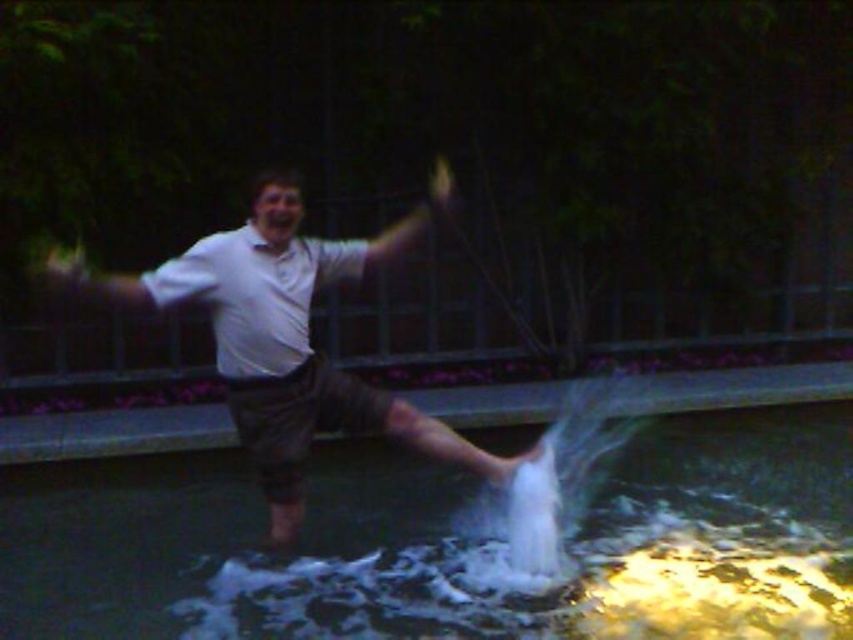
Question: Which point appears farthest from the camera in this image?

Choices:
 (A) (299, 548)
 (B) (260, 193)
 (C) (595, 433)

Answer: (C)

Question: Is white frothy water at center to the left of white cotton shirt at center from the viewer's perspective?

Choices:
 (A) no
 (B) yes

Answer: (A)

Question: Which object is closer to the camera taking this photo?

Choices:
 (A) white cotton shirt at center
 (B) white frothy water at center

Answer: (B)

Question: Which of the following is the farthest from the observer?

Choices:
 (A) (770, 429)
 (B) (570, 516)
 (C) (318, 381)

Answer: (A)

Question: Does white frothy water at center come in front of white frothy water at lower center?

Choices:
 (A) no
 (B) yes

Answer: (B)

Question: Is white frothy water at center to the left of white cotton shirt at center from the viewer's perspective?

Choices:
 (A) yes
 (B) no

Answer: (B)